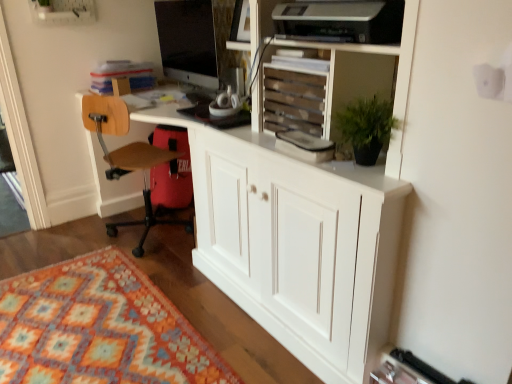
Question: Does brown wood chair at left appear on the right side of wooden slats at upper center?

Choices:
 (A) yes
 (B) no

Answer: (B)

Question: From the image's perspective, is brown wood chair at left on top of wooden slats at upper center?

Choices:
 (A) no
 (B) yes

Answer: (A)

Question: Could you tell me if brown wood chair at left is facing wooden slats at upper center?

Choices:
 (A) no
 (B) yes

Answer: (A)

Question: Is brown wood chair at left thinner than wooden slats at upper center?

Choices:
 (A) yes
 (B) no

Answer: (B)

Question: Is brown wood chair at left positioned before wooden slats at upper center?

Choices:
 (A) no
 (B) yes

Answer: (A)

Question: From the image's perspective, is brown wood chair at left under wooden slats at upper center?

Choices:
 (A) no
 (B) yes

Answer: (B)

Question: From the image's perspective, is matte black monitor at upper center under multicolored woven rug at lower left?

Choices:
 (A) no
 (B) yes

Answer: (A)

Question: Is matte black monitor at upper center not inside multicolored woven rug at lower left?

Choices:
 (A) no
 (B) yes

Answer: (B)

Question: From a real-world perspective, is matte black monitor at upper center on multicolored woven rug at lower left?

Choices:
 (A) yes
 (B) no

Answer: (A)

Question: Does matte black monitor at upper center have a lesser height compared to multicolored woven rug at lower left?

Choices:
 (A) yes
 (B) no

Answer: (B)

Question: Is matte black monitor at upper center smaller than multicolored woven rug at lower left?

Choices:
 (A) no
 (B) yes

Answer: (A)

Question: Is matte black monitor at upper center touching multicolored woven rug at lower left?

Choices:
 (A) yes
 (B) no

Answer: (B)

Question: From the image's perspective, would you say wooden slats at upper center is positioned over multicolored woven rug at lower left?

Choices:
 (A) yes
 (B) no

Answer: (A)